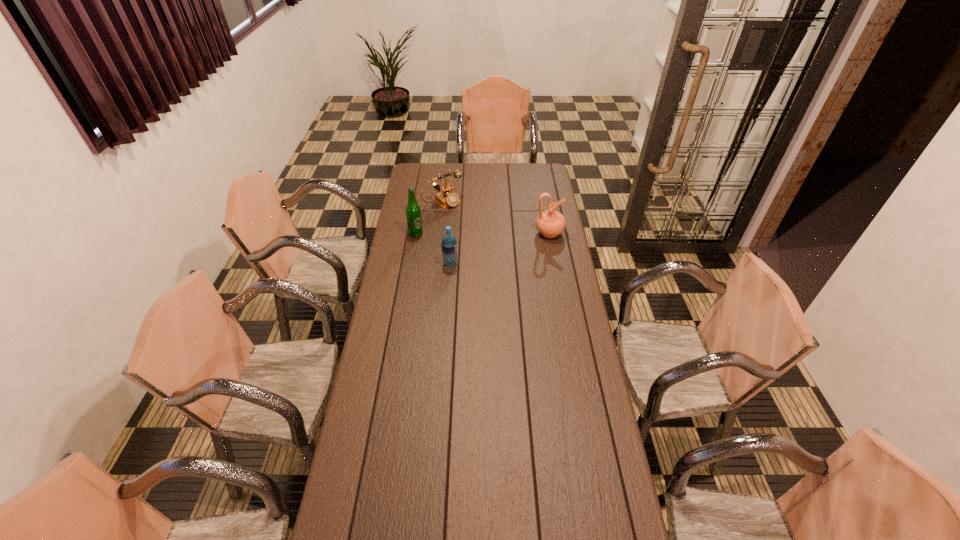
Identify the location of water bottle. (449, 243).

The image size is (960, 540). Identify the location of pottery. pyautogui.click(x=550, y=223).

Image resolution: width=960 pixels, height=540 pixels. I want to click on the shortest object, so click(447, 197).

Where is `telephone`? The height and width of the screenshot is (540, 960). telephone is located at coordinates (447, 197).

Where is `beer bottle`? The height and width of the screenshot is (540, 960). beer bottle is located at coordinates (413, 211).

Where is `blank space located 0.390m on the back of the nearest object`? blank space located 0.390m on the back of the nearest object is located at coordinates (454, 213).

Where is `vacant region located on the dial number of the telephone`? The image size is (960, 540). vacant region located on the dial number of the telephone is located at coordinates (474, 227).

The width and height of the screenshot is (960, 540). In order to click on vacant region located 0.150m on the dial number of the telephone in this screenshot , I will do `click(468, 222)`.

What are the coordinates of `vacant space located on the dial number of the telephone` in the screenshot? It's located at (464, 218).

Where is `free space located 0.220m on the label of the beer bottle`? free space located 0.220m on the label of the beer bottle is located at coordinates (463, 241).